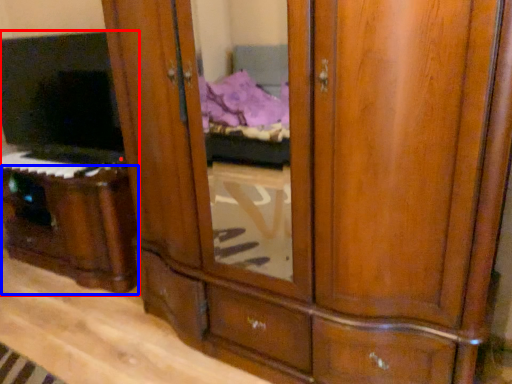
Question: Which object is further to the camera taking this photo, entertainment center (highlighted by a red box) or vanity (highlighted by a blue box)?

Choices:
 (A) entertainment center
 (B) vanity

Answer: (B)